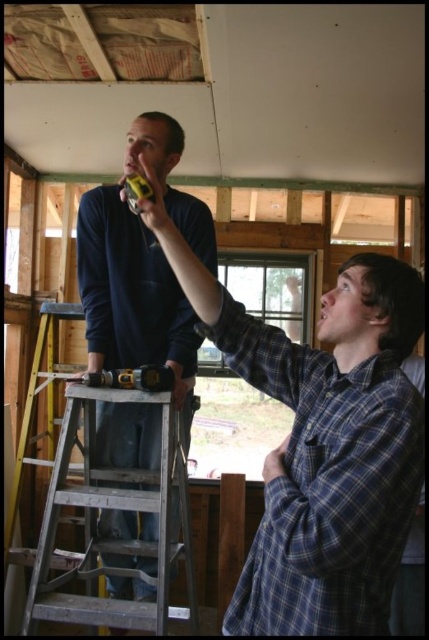
You are an observer standing in the room. You see the dark blue shirt at upper left and the silver metallic ladder at left. Which object is bigger in size?

The dark blue shirt at upper left has a larger size compared to the silver metallic ladder at left, so the dark blue shirt at upper left is bigger.

You are a contractor assessing the layout of this construction site. You need to determine if the silver metallic ladder at left can be placed next to the yellow plastic drill at center without overlapping. Given their widths, is this possible?

The silver metallic ladder at left is wider than the yellow plastic drill at center. Since the ladder is wider, there must be sufficient space between them to accommodate its greater width. However, without knowing the exact available space, it is impossible to definitively say if they can be placed next to each other without overlapping. More information about the distance between them or the total available space is needed to make an accurate assessment.

You are an inspector checking safety equipment in a construction site. You see the dark blue shirt at upper left and the yellow plastic drill at center. Which object is bigger in size?

The dark blue shirt at upper left is larger in size compared to the yellow plastic drill at center according to the description.